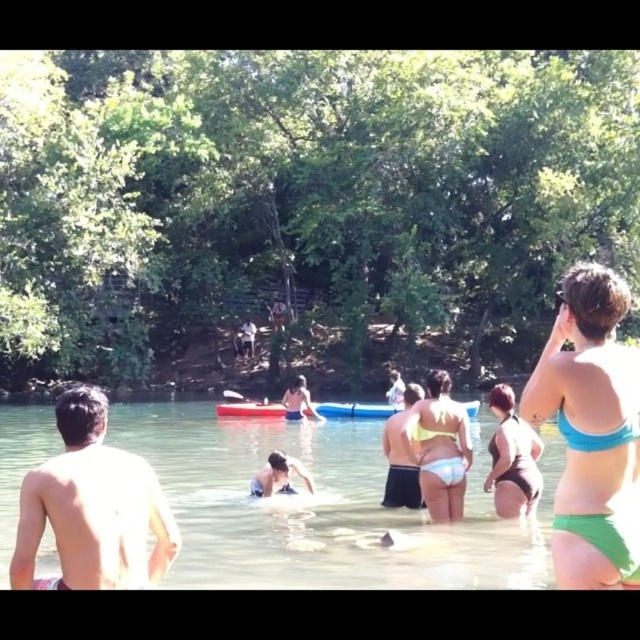
You are a photographer trying to capture a shot of the light blue fabric swimsuit at center. The kayaks are moving towards the center. Which direction should you move to keep the swimsuit in frame while avoiding the kayaks?

The light blue fabric swimsuit at center is located at point (298, 401). Since the kayaks are moving towards the center, you should move to the side opposite of their direction to keep the swimsuit in frame while avoiding them.

You are a photographer taking a picture of the yellow bikini bottom at center and the blue matte bikini top at upper right. Which object should you focus on first if you want to capture both in the same frame without moving the camera?

You should focus on the yellow bikini bottom at center first because it is located below the blue matte bikini top at upper right, so adjusting focus from bottom to top might help capture both in the same frame.

You are a photographer trying to capture a photo of the green bikini bottom at right and the black matte swimsuit at lower right. Which object should you focus on first if you want to include both in your frame without moving the camera?

The green bikini bottom at right is positioned on the right side of the black matte swimsuit at lower right. Since the green bikini bottom at right is already on the right side of the black matte swimsuit at lower right, you should focus on the black matte swimsuit at lower right first to ensure both are in the frame without moving the camera.